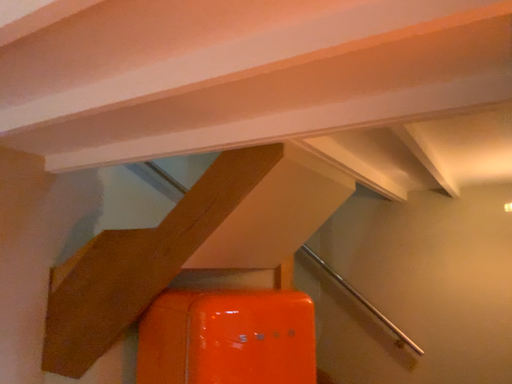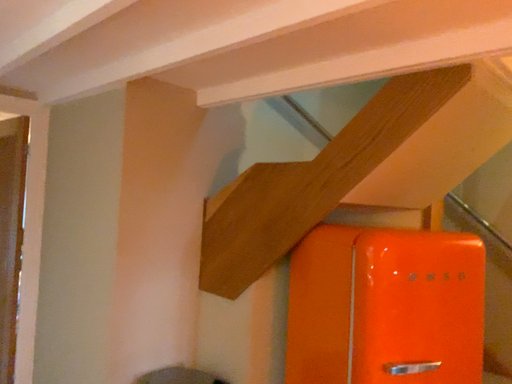
Question: Which way did the camera rotate in the video?

Choices:
 (A) rotated left
 (B) rotated right

Answer: (A)